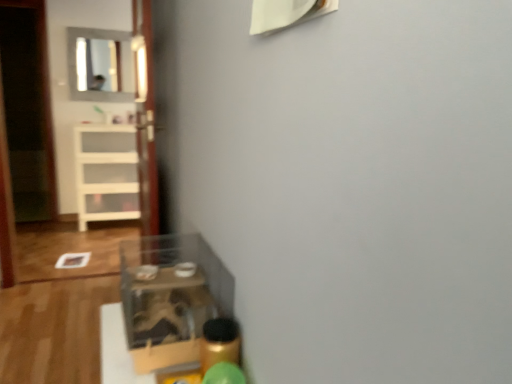
Question: From the image's perspective, relative to matte glass mirror at upper left, is transparent glass door at center above or below?

Choices:
 (A) below
 (B) above

Answer: (A)

Question: Considering the positions of transparent glass door at center and matte glass mirror at upper left in the image, is transparent glass door at center taller or shorter than matte glass mirror at upper left?

Choices:
 (A) short
 (B) tall

Answer: (B)

Question: Based on their relative distances, which object is farther from the white glossy shelf at left, positioned as the first shelf in left-to-right order?

Choices:
 (A) transparent plastic shelf at lower left, which is the first shelf in bottom-to-top order
 (B) matte glass mirror at upper left
 (C) transparent glass door at center

Answer: (A)

Question: Which of these objects is positioned farthest from the transparent plastic shelf at lower left, the second shelf from the back?

Choices:
 (A) white glossy shelf at left, the second shelf when ordered from right to left
 (B) matte glass mirror at upper left
 (C) transparent glass door at center

Answer: (B)